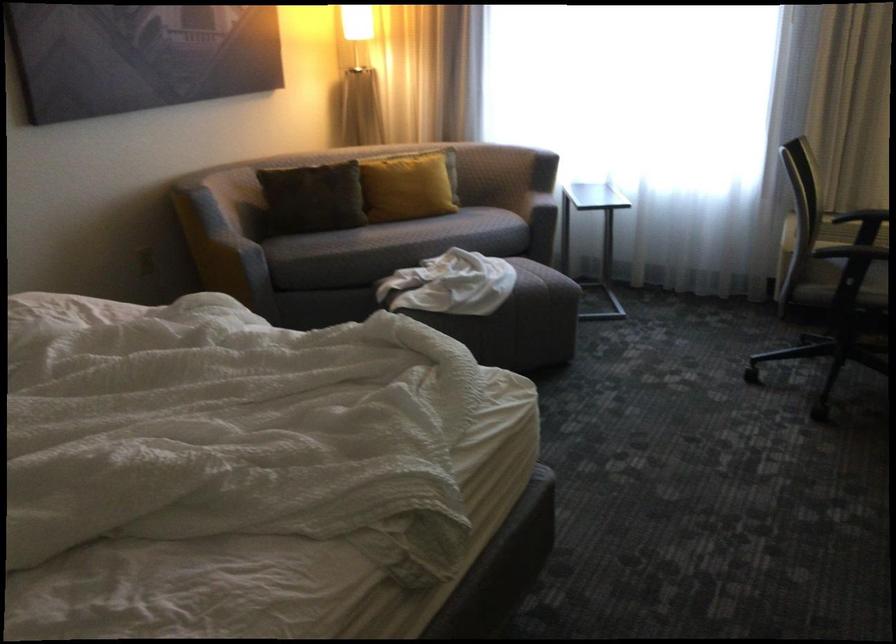
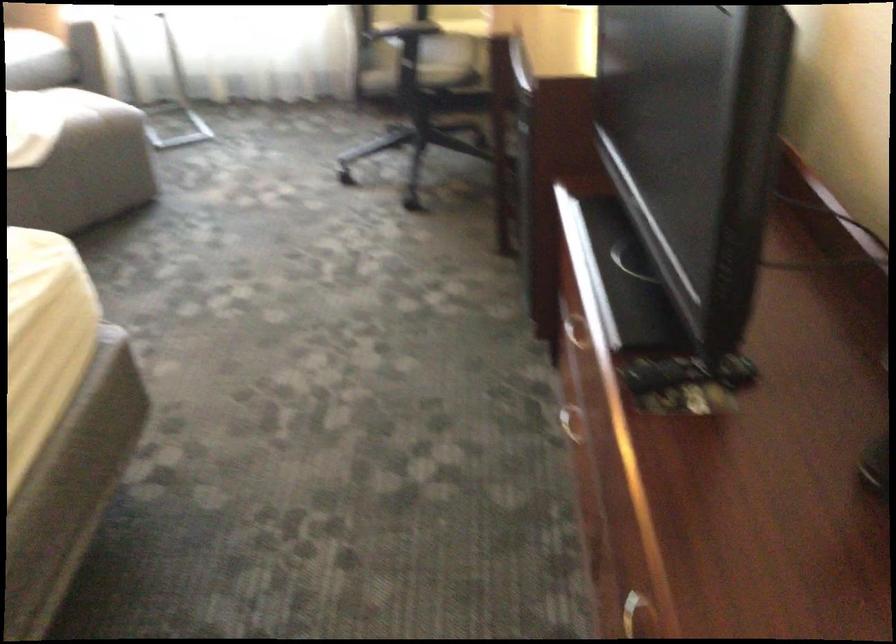
Question: The images are taken continuously from a first-person perspective. In which direction is your viewpoint rotating?

Choices:
 (A) Left
 (B) Right
 (C) Up
 (D) Down

Answer: (B)